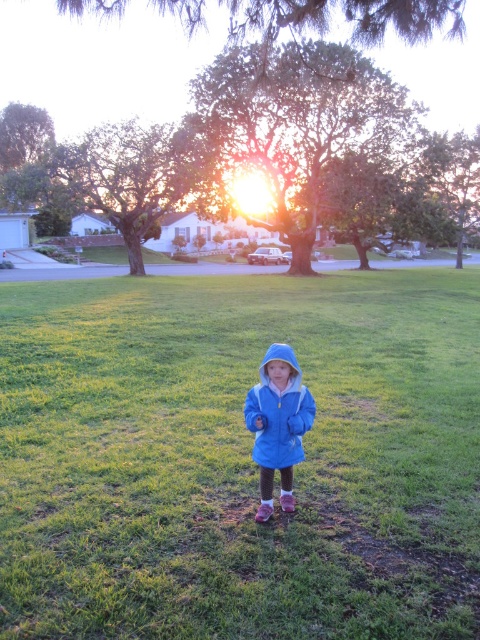
You are a photographer trying to capture a shot of both the blue fleece jacket at center and the matte blue jacket at center in the same frame. Based on their positions, will you need to adjust your camera angle to include both?

The blue fleece jacket at center is wider than the matte blue jacket at center, so you may need to adjust your camera angle to ensure both are fully visible in the frame.

A child wearing a bright blue hooded jacket is standing in a suburban area. There is a point at coordinates point [29,534]. How far apart are the child and the point?

The child and the point are 3.95 meters apart.

In the scene shown: Where is the blue fleece jacket at center located in the image?

The blue fleece jacket at center is located at point 0.717 on the x axis and 0.498 on the y axis.